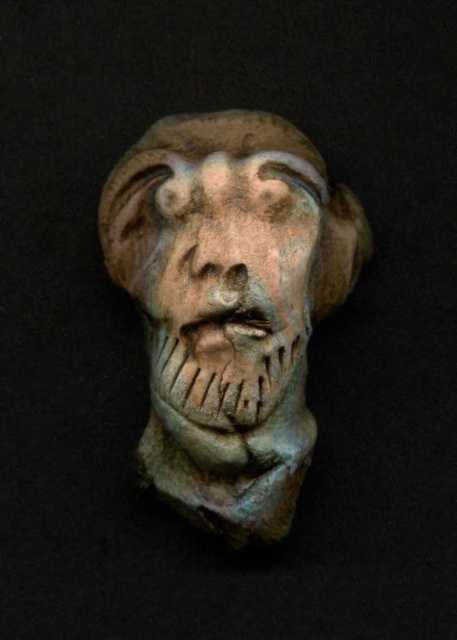
Question: Which of the following is the farthest from the observer?

Choices:
 (A) (266, 120)
 (B) (228, 241)

Answer: (A)

Question: Which point is farther from the camera taking this photo?

Choices:
 (A) (245, 236)
 (B) (235, 240)
 (C) (267, 477)

Answer: (C)

Question: Is matte clay mask at center positioned before matte clay face at center?

Choices:
 (A) no
 (B) yes

Answer: (A)

Question: Does matte clay mask at center appear on the left side of matte clay face at center?

Choices:
 (A) yes
 (B) no

Answer: (B)

Question: Considering the relative positions of matte clay mask at center and matte clay nose at center in the image provided, where is matte clay mask at center located with respect to matte clay nose at center?

Choices:
 (A) below
 (B) above

Answer: (A)

Question: Which object appears farthest from the camera in this image?

Choices:
 (A) matte clay mask at center
 (B) matte clay nose at center

Answer: (A)